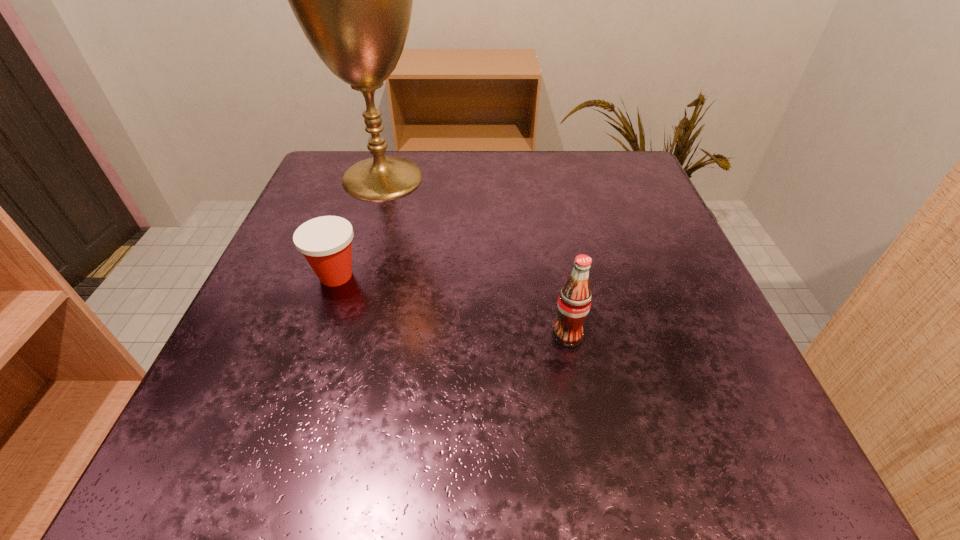
You are a GUI agent. You are given a task and a screenshot of the screen. Output one action in this format:
    pyautogui.click(x=<x>, y=<y>)
    Task: Click on the trophy cup present at the left edge
    This screenshot has width=960, height=540.
    Given the screenshot: What is the action you would take?
    pyautogui.click(x=353, y=0)

Identify the location of Dixie cup that is positioned at the left edge. The width and height of the screenshot is (960, 540). (326, 242).

The image size is (960, 540). In order to click on object that is at the far left corner in this screenshot , I will do `click(353, 0)`.

Image resolution: width=960 pixels, height=540 pixels. I want to click on vacant space at the far edge, so click(482, 155).

The image size is (960, 540). In the image, there is a desktop. What are the coordinates of `vacant space at the left edge` in the screenshot? It's located at (246, 330).

This screenshot has width=960, height=540. In the image, there is a desktop. Find the location of `free space at the right edge`. free space at the right edge is located at coordinates (639, 301).

Where is `vacant space at the far left corner`? This screenshot has width=960, height=540. vacant space at the far left corner is located at coordinates (338, 206).

The height and width of the screenshot is (540, 960). In the image, there is a desktop. What are the coordinates of `vacant space at the far right corner` in the screenshot? It's located at (599, 163).

This screenshot has height=540, width=960. In order to click on vacant space at the near right corner of the desktop in this screenshot , I will do `click(718, 449)`.

At what (x,y) coordinates should I click in order to perform the action: click on blank region between the farthest object and the second tallest object. Please return your answer as a coordinate pair (x, y). This screenshot has height=540, width=960. Looking at the image, I should click on (475, 256).